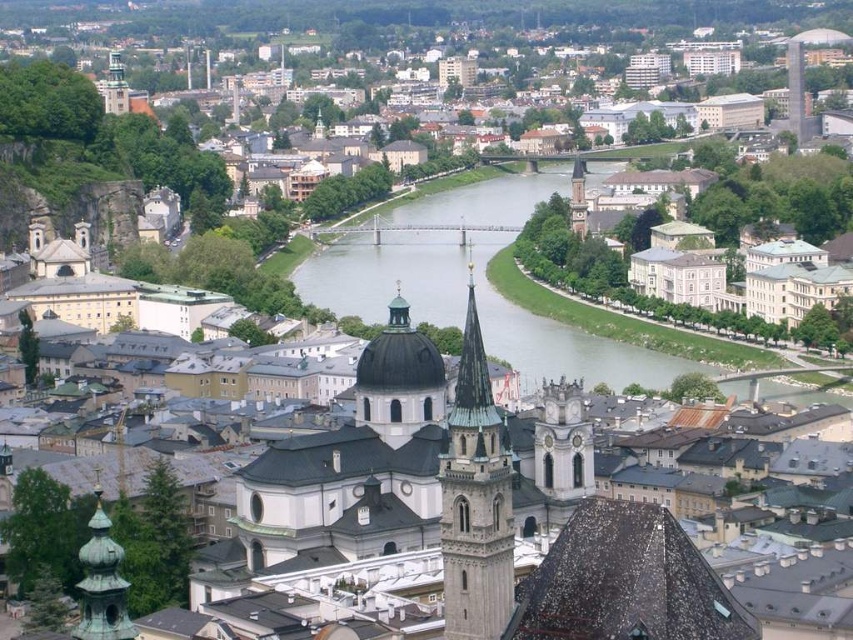
You are a tourist in the city and want to cross the river using the bridge. The bridge is located over the silvery waterway at center. If the green copper tower at lower left is 30 meters wide, can you estimate the minimum width of the bridge?

The silvery waterway at center is wider than the green copper tower at lower left, which is 30 meters wide. Therefore, the bridge must be at least wider than 30 meters to span the waterway.

You are standing in the city square and want to take a photo of the white stone dome at center and the white stone clock tower at center. Which one will appear larger in your photo?

The white stone dome at center will appear larger in your photo because it is positioned in front of the white stone clock tower at center, making it closer to the camera and thus larger in the frame.

You are standing at the riverbank and want to take a photo of the smooth stone tower at center and the matte gold clock tower at upper left. Which tower will appear larger in the photo?

The smooth stone tower at center will appear larger in the photo because it is closer to you than the matte gold clock tower at upper left.